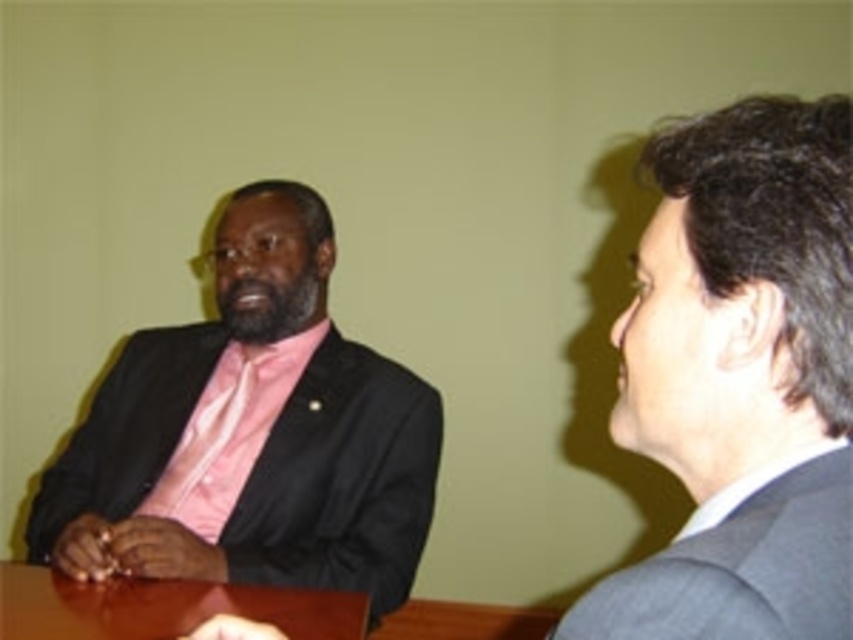
Question: Can you confirm if gray wool suit at right is positioned to the left of brown wooden table at center?

Choices:
 (A) no
 (B) yes

Answer: (A)

Question: From the image, what is the correct spatial relationship of gray wool suit at right in relation to brown wooden table at center?

Choices:
 (A) below
 (B) above

Answer: (B)

Question: Which object appears closest to the camera in this image?

Choices:
 (A) matte black suit at left
 (B) gray wool suit at right
 (C) brown wooden table at center

Answer: (B)

Question: Which point is farther to the camera?

Choices:
 (A) gray wool suit at right
 (B) pink satin tie at left

Answer: (B)

Question: Is brown wooden table at center smaller than pink satin tie at left?

Choices:
 (A) no
 (B) yes

Answer: (B)

Question: Which object is farther from the camera taking this photo?

Choices:
 (A) brown wooden table at center
 (B) pink satin tie at left
 (C) matte black suit at left

Answer: (B)